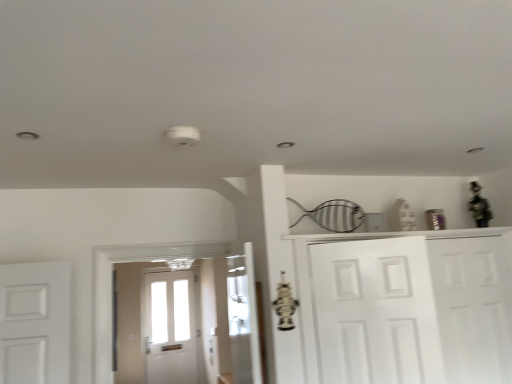
Question: Does white matte door at right, the 2th door viewed from the left, have a greater width compared to white matte door at center, positioned as the first door in front-to-back order?

Choices:
 (A) yes
 (B) no

Answer: (A)

Question: Is white matte door at right, positioned as the first door in back-to-front order, facing away from white matte door at center, the 1th door from the left?

Choices:
 (A) yes
 (B) no

Answer: (B)

Question: From the image's perspective, is white matte door at right, the 1th door when ordered from right to left, beneath white matte door at center, which ranks as the second door in back-to-front order?

Choices:
 (A) no
 (B) yes

Answer: (B)

Question: Does white matte door at right, the 1th door when ordered from right to left, have a larger size compared to white matte door at center, the second door when ordered from right to left?

Choices:
 (A) no
 (B) yes

Answer: (B)

Question: Does white matte door at right, positioned as the first door in back-to-front order, have a smaller size compared to white matte door at center, which ranks as the second door in back-to-front order?

Choices:
 (A) yes
 (B) no

Answer: (B)

Question: Is white matte door at right, positioned as the second door in front-to-back order, touching white matte door at center, the second door when ordered from right to left?

Choices:
 (A) no
 (B) yes

Answer: (A)

Question: Is white matte cabinet at right taller than white matte door at right, the 2th door viewed from the left?

Choices:
 (A) yes
 (B) no

Answer: (A)

Question: Does white matte cabinet at right come behind white matte door at right, the 1th door when ordered from right to left?

Choices:
 (A) no
 (B) yes

Answer: (A)

Question: Does white matte cabinet at right appear on the right side of white matte door at right, the 2th door viewed from the left?

Choices:
 (A) no
 (B) yes

Answer: (A)

Question: Considering the relative sizes of white matte cabinet at right and white matte door at right, positioned as the second door in front-to-back order, in the image provided, is white matte cabinet at right smaller than white matte door at right, positioned as the second door in front-to-back order,?

Choices:
 (A) no
 (B) yes

Answer: (A)

Question: From a real-world perspective, is white matte cabinet at right located higher than white matte door at right, positioned as the first door in back-to-front order?

Choices:
 (A) yes
 (B) no

Answer: (B)

Question: From the image's perspective, is white matte cabinet at right above white matte door at right, positioned as the first door in back-to-front order?

Choices:
 (A) yes
 (B) no

Answer: (B)

Question: Considering the relative positions of white matte door at center, which ranks as the second door in back-to-front order, and white matte cabinet at right in the image provided, is white matte door at center, which ranks as the second door in back-to-front order, to the left of white matte cabinet at right from the viewer's perspective?

Choices:
 (A) no
 (B) yes

Answer: (B)